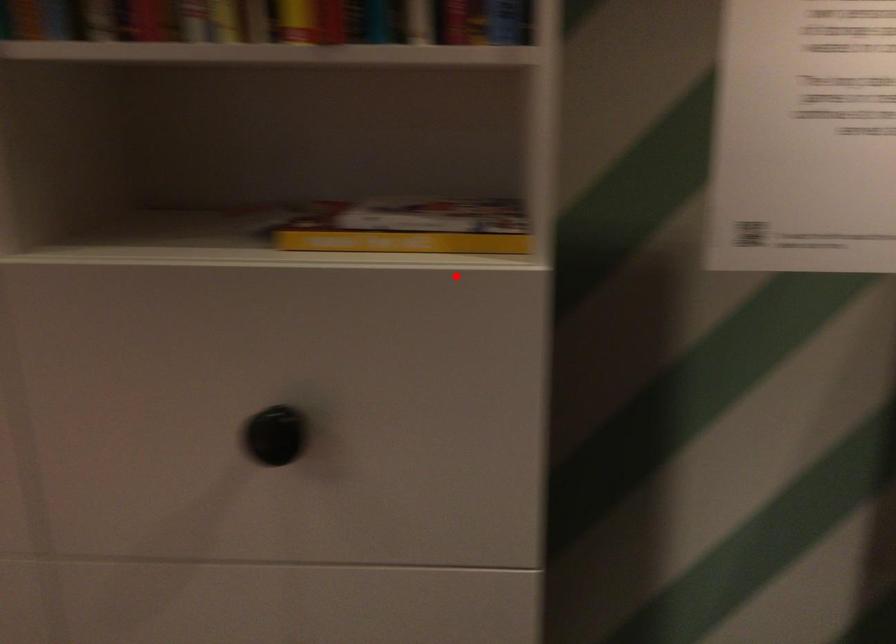
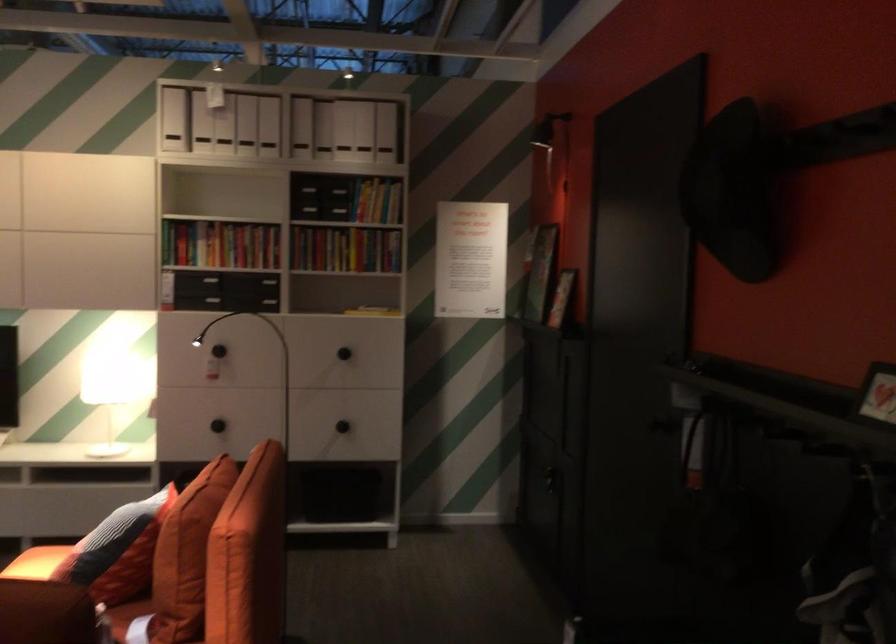
In the second image, find the point that corresponds to the highlighted location in the first image.

(372, 310)